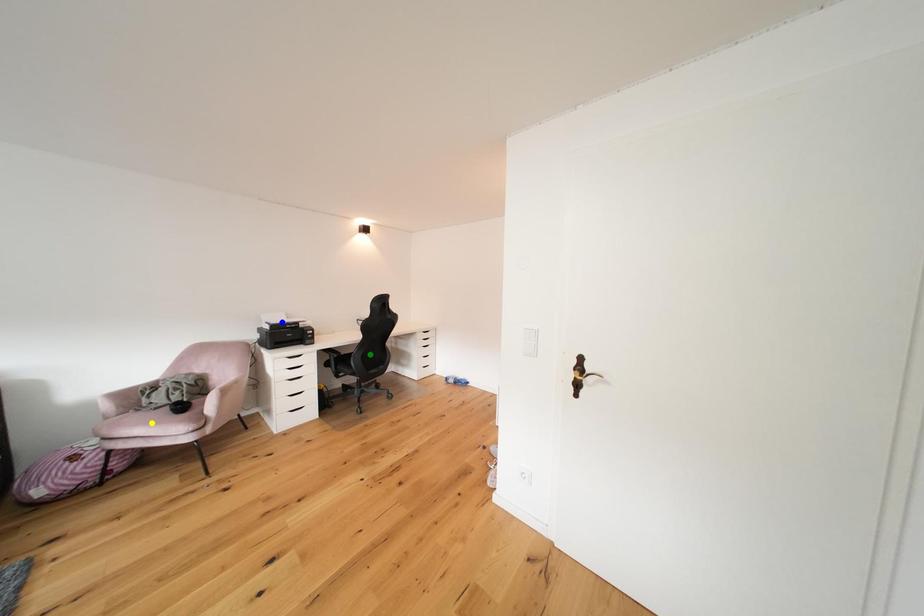
Order these from nearest to farthest:
1. green point
2. blue point
3. yellow point

yellow point → blue point → green point